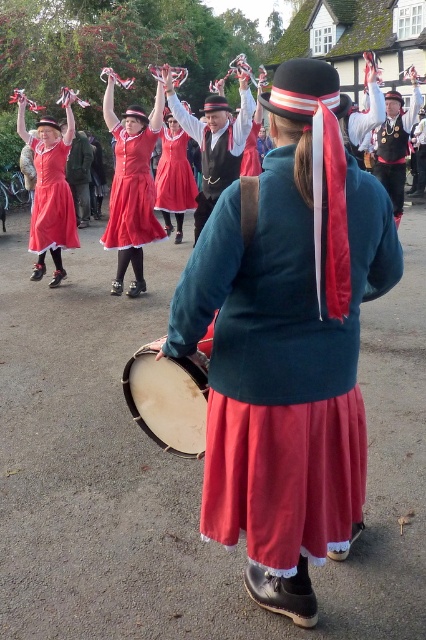
From the picture: You are a photographer trying to capture the entire scene in one shot. The light brown drum at center and the matte red dress at center are both important subjects. Which object should you focus on first to ensure it fits entirely within the frame?

The light brown drum at center is smaller than the matte red dress at center, so you should focus on capturing the matte red dress at center first since it is larger and might require more framing adjustments to ensure it fits entirely within the shot.

You are observing a group of dancers in a traditional performance. You notice two people wearing the matte red dress at upper center and the matte red dress at left. Which of these two dresses appears narrower?

The matte red dress at upper center appears narrower than the matte red dress at left because its width is less than the latter.